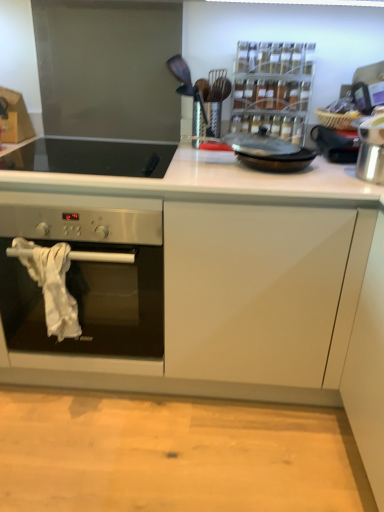
Question: Based on their sizes in the image, would you say clear plastic spice rack at upper center, which is counted as the 2th appliance, starting from the left, is bigger or smaller than silver metallic pot at right, positioned as the 3th appliance in left-to-right order?

Choices:
 (A) big
 (B) small

Answer: (A)

Question: In terms of height, does clear plastic spice rack at upper center, which is the 2th appliance from right to left, look taller or shorter compared to silver metallic pot at right, marked as the 1th appliance in a right-to-left arrangement?

Choices:
 (A) short
 (B) tall

Answer: (B)

Question: Which object is the farthest from the black glass cooktop at upper left?

Choices:
 (A) black glass frying pan at center
 (B) clear plastic spice rack at upper center, which is the 2th appliance from right to left
 (C) metallic silver ladle at upper center, placed as the first appliance when sorted from left to right
 (D) silver metallic pot at right, positioned as the 3th appliance in left-to-right order

Answer: (D)

Question: Which object is the closest to the clear plastic spice rack at upper center, which is counted as the 2th appliance, starting from the left?

Choices:
 (A) silver metallic pot at right, positioned as the 3th appliance in left-to-right order
 (B) black glass cooktop at upper left
 (C) black glass frying pan at center
 (D) metallic silver ladle at upper center, placed as the first appliance when sorted from left to right

Answer: (A)